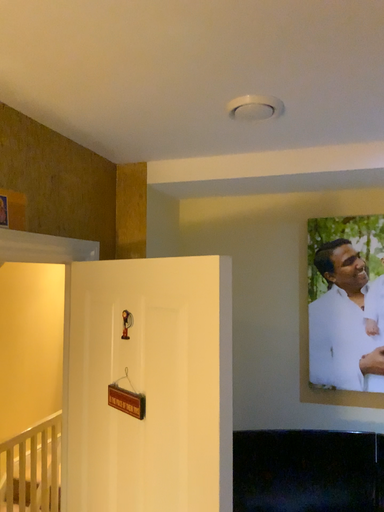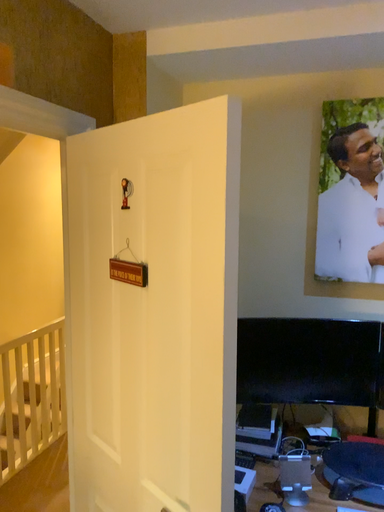
Question: How did the camera likely rotate when shooting the video?

Choices:
 (A) rotated downward
 (B) rotated upward

Answer: (A)